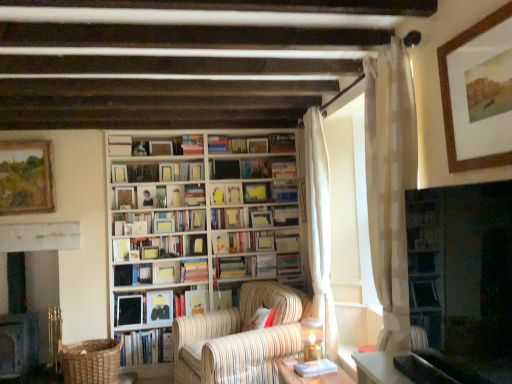
This screenshot has width=512, height=384. Find the location of `empty space that is ontop of wooden framed painting at upper left, positioned as the 1th picture frame in back-to-front order (from a real-world perspective)`. empty space that is ontop of wooden framed painting at upper left, positioned as the 1th picture frame in back-to-front order (from a real-world perspective) is located at coordinates (24, 141).